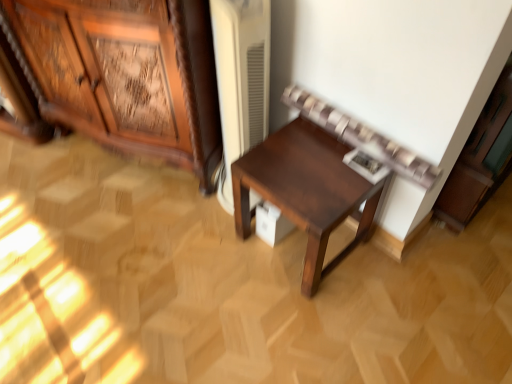
Question: From the image's perspective, is wooden carved cabinet at left, the first cabinetry viewed from the left, under white matte cabinet at upper right, placed as the 2th cabinetry when sorted from left to right?

Choices:
 (A) no
 (B) yes

Answer: (A)

Question: Is the position of wooden carved cabinet at left, which is counted as the 2th cabinetry, starting from the right, more distant than that of white matte cabinet at upper right, arranged as the 1th cabinetry when viewed from the right?

Choices:
 (A) no
 (B) yes

Answer: (B)

Question: Is wooden carved cabinet at left, which is counted as the 2th cabinetry, starting from the right, oriented away from white matte cabinet at upper right, placed as the 2th cabinetry when sorted from left to right?

Choices:
 (A) yes
 (B) no

Answer: (B)

Question: Does wooden carved cabinet at left, which is counted as the 2th cabinetry, starting from the right, appear on the right side of white matte cabinet at upper right, placed as the 2th cabinetry when sorted from left to right?

Choices:
 (A) yes
 (B) no

Answer: (B)

Question: Is the depth of wooden carved cabinet at left, which is counted as the 2th cabinetry, starting from the right, less than that of white matte cabinet at upper right, arranged as the 1th cabinetry when viewed from the right?

Choices:
 (A) yes
 (B) no

Answer: (B)

Question: Is point (265, 175) closer or farther from the camera than point (459, 158)?

Choices:
 (A) farther
 (B) closer

Answer: (B)

Question: Is dark wood table at center to the left or to the right of white matte cabinet at upper right, arranged as the 1th cabinetry when viewed from the right, in the image?

Choices:
 (A) left
 (B) right

Answer: (A)

Question: Based on their sizes in the image, would you say dark wood table at center is bigger or smaller than white matte cabinet at upper right, placed as the 2th cabinetry when sorted from left to right?

Choices:
 (A) big
 (B) small

Answer: (B)

Question: Choose the correct answer: Is dark wood table at center inside white matte cabinet at upper right, placed as the 2th cabinetry when sorted from left to right, or outside it?

Choices:
 (A) inside
 (B) outside

Answer: (B)

Question: Does point (160, 114) appear closer or farther from the camera than point (304, 160)?

Choices:
 (A) farther
 (B) closer

Answer: (A)

Question: In terms of height, does wooden carved cabinet at left, which is counted as the 2th cabinetry, starting from the right, look taller or shorter compared to dark wood table at center?

Choices:
 (A) short
 (B) tall

Answer: (B)

Question: From a real-world perspective, is wooden carved cabinet at left, which is counted as the 2th cabinetry, starting from the right, above or below dark wood table at center?

Choices:
 (A) below
 (B) above

Answer: (B)

Question: Looking at their shapes, would you say wooden carved cabinet at left, which is counted as the 2th cabinetry, starting from the right, is wider or thinner than dark wood table at center?

Choices:
 (A) wide
 (B) thin

Answer: (A)

Question: In the image, is white matte cabinet at upper right, arranged as the 1th cabinetry when viewed from the right, on the left side or the right side of wooden carved cabinet at left, the first cabinetry viewed from the left?

Choices:
 (A) left
 (B) right

Answer: (B)

Question: From the image's perspective, is white matte cabinet at upper right, placed as the 2th cabinetry when sorted from left to right, above or below wooden carved cabinet at left, the first cabinetry viewed from the left?

Choices:
 (A) above
 (B) below

Answer: (B)